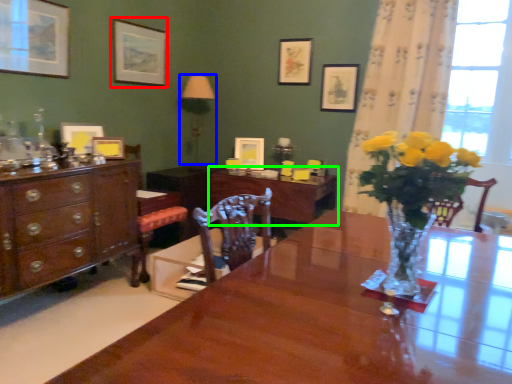
Question: Based on their relative distances, which object is farther from picture frame (highlighted by a red box)? Choose from lamp (highlighted by a blue box) and table (highlighted by a green box).

Choices:
 (A) lamp
 (B) table

Answer: (B)